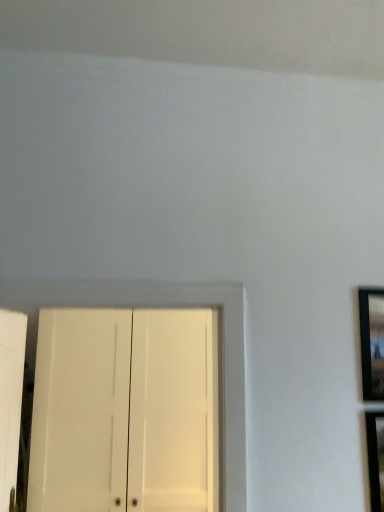
I want to click on black glossy picture frame at right, so click(x=372, y=342).

This screenshot has height=512, width=384. What do you see at coordinates (372, 342) in the screenshot?
I see `black glossy picture frame at right` at bounding box center [372, 342].

What are the coordinates of `white matte cabinet at lower left` in the screenshot? It's located at (80, 412).

The height and width of the screenshot is (512, 384). Describe the element at coordinates (80, 412) in the screenshot. I see `white matte cabinet at lower left` at that location.

I want to click on black glossy picture frame at right, so click(372, 342).

In the scene shown: Does white matte cabinet at lower left appear on the right side of black glossy picture frame at right?

No, white matte cabinet at lower left is not to the right of black glossy picture frame at right.

Considering the positions of objects white matte cabinet at lower left and black glossy picture frame at right in the image provided, who is in front, white matte cabinet at lower left or black glossy picture frame at right?

black glossy picture frame at right is more forward.

Which is behind, point (92, 464) or point (382, 354)?

The point (92, 464) is farther.

From the image's perspective, which is below, white matte cabinet at lower left or black glossy picture frame at right?

white matte cabinet at lower left, from the image's perspective.

From a real-world perspective, between white matte cabinet at lower left and black glossy picture frame at right, who is vertically higher?

From a 3D spatial view, black glossy picture frame at right is above.

Can you confirm if white matte cabinet at lower left is wider than black glossy picture frame at right?

Indeed, white matte cabinet at lower left has a greater width compared to black glossy picture frame at right.

Which of these two, white matte cabinet at lower left or black glossy picture frame at right, stands taller?

white matte cabinet at lower left.

Who is smaller, white matte cabinet at lower left or black glossy picture frame at right?

black glossy picture frame at right is smaller.

Do you think white matte cabinet at lower left is within black glossy picture frame at right, or outside of it?

white matte cabinet at lower left lies outside black glossy picture frame at right.

Are white matte cabinet at lower left and black glossy picture frame at right making contact?

No, white matte cabinet at lower left is not in contact with black glossy picture frame at right.

Is white matte cabinet at lower left aimed at black glossy picture frame at right?

No, white matte cabinet at lower left is not facing towards black glossy picture frame at right.

What's the angular difference between white matte cabinet at lower left and black glossy picture frame at right's facing directions?

There is a 1.06-degree angle between the facing directions of white matte cabinet at lower left and black glossy picture frame at right.

Identify the location of door lying behind the black glossy picture frame at right. The height and width of the screenshot is (512, 384). (80, 412).

Between black glossy picture frame at right and white matte cabinet at lower left, which one appears on the left side from the viewer's perspective?

white matte cabinet at lower left.

Is black glossy picture frame at right in front of or behind white matte cabinet at lower left in the image?

Clearly, black glossy picture frame at right is in front of white matte cabinet at lower left.

Does point (377, 339) come farther from viewer compared to point (48, 496)?

No, it is not.

From the image's perspective, is black glossy picture frame at right above or below white matte cabinet at lower left?

Clearly, from the image's perspective, black glossy picture frame at right is above white matte cabinet at lower left.

From a real-world perspective, is black glossy picture frame at right physically located above or below white matte cabinet at lower left?

In terms of real-world spatial position, black glossy picture frame at right is above white matte cabinet at lower left.

Based on the photo, is black glossy picture frame at right wider or thinner than white matte cabinet at lower left?

In the image, black glossy picture frame at right appears to be more narrow than white matte cabinet at lower left.

Can you confirm if black glossy picture frame at right is shorter than white matte cabinet at lower left?

Yes.

Based on their sizes in the image, would you say black glossy picture frame at right is bigger or smaller than white matte cabinet at lower left?

Considering their sizes, black glossy picture frame at right takes up less space than white matte cabinet at lower left.

Is white matte cabinet at lower left located within black glossy picture frame at right?

Definitely not — white matte cabinet at lower left is not inside black glossy picture frame at right.

Is black glossy picture frame at right next to white matte cabinet at lower left and touching it?

No, black glossy picture frame at right is not with white matte cabinet at lower left.

Could you tell me if black glossy picture frame at right is facing white matte cabinet at lower left?

No, black glossy picture frame at right is not aimed at white matte cabinet at lower left.

How many degrees apart are the facing directions of black glossy picture frame at right and white matte cabinet at lower left?

The facing directions of black glossy picture frame at right and white matte cabinet at lower left are 1.06 degrees apart.

Image resolution: width=384 pixels, height=512 pixels. I want to click on door below the black glossy picture frame at right (from a real-world perspective), so click(80, 412).

You are a GUI agent. You are given a task and a screenshot of the screen. Output one action in this format:
    pyautogui.click(x=<x>, y=<y>)
    Task: Click on the door behind the black glossy picture frame at right
    This screenshot has height=512, width=384.
    Given the screenshot: What is the action you would take?
    pyautogui.click(x=80, y=412)

The height and width of the screenshot is (512, 384). I want to click on door below the black glossy picture frame at right (from the image's perspective), so click(x=80, y=412).